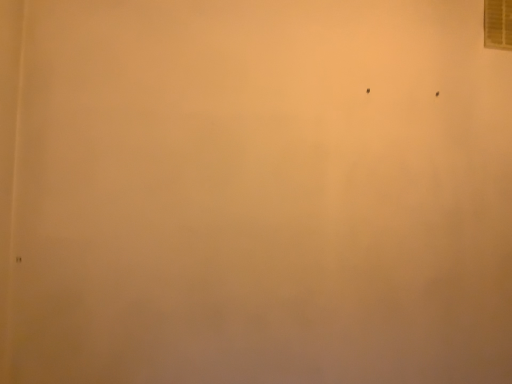
What is the approximate height of clear glass window at upper right?

clear glass window at upper right is 11.00 inches tall.

What do you see at coordinates (498, 24) in the screenshot? This screenshot has height=384, width=512. I see `clear glass window at upper right` at bounding box center [498, 24].

This screenshot has width=512, height=384. I want to click on clear glass window at upper right, so click(x=498, y=24).

The image size is (512, 384). Identify the location of clear glass window at upper right. (498, 24).